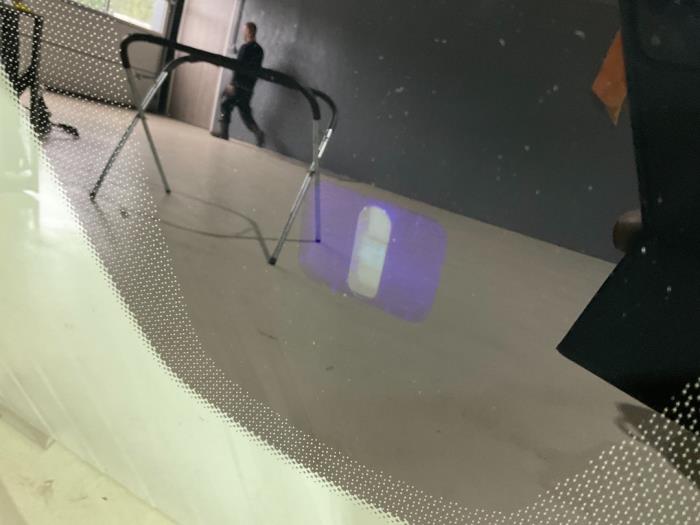
At what (x,y) coordinates should I click in order to perform the action: click on empty wall. Please return your answer as a coordinate pair (x, y). Looking at the image, I should click on [472, 80].